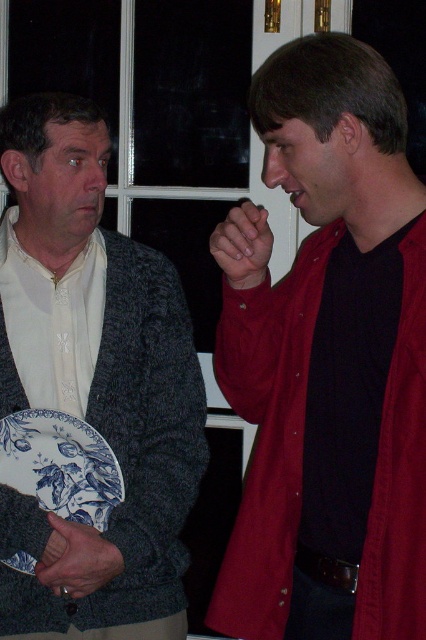
Can you confirm if matte red shirt at center is taller than blue printed platter at left?

Yes, matte red shirt at center is taller than blue printed platter at left.

Who is shorter, matte red shirt at center or blue printed platter at left?

Standing shorter between the two is blue printed platter at left.

Measure the distance between point (299, 604) and camera.

A distance of 1.45 meters exists between point (299, 604) and camera.

Find the location of `matte red shirt at center`. matte red shirt at center is located at coordinates (328, 352).

Can you confirm if matte black sweater at left is thinner than blue printed platter at left?

Incorrect, matte black sweater at left's width is not less than blue printed platter at left's.

Who is taller, matte black sweater at left or blue printed platter at left?

With more height is matte black sweater at left.

Between point (48, 506) and point (88, 452), which one is positioned in front?

Positioned in front is point (48, 506).

Find the location of a particular element. The height and width of the screenshot is (640, 426). matte black sweater at left is located at coordinates (89, 397).

What do you see at coordinates (328, 352) in the screenshot? I see `matte red shirt at center` at bounding box center [328, 352].

Does matte red shirt at center have a greater width compared to matte black sweater at left?

In fact, matte red shirt at center might be narrower than matte black sweater at left.

Is point (334, 595) closer to camera compared to point (25, 536)?

That is True.

Where is `matte red shirt at center`? This screenshot has height=640, width=426. matte red shirt at center is located at coordinates 328,352.